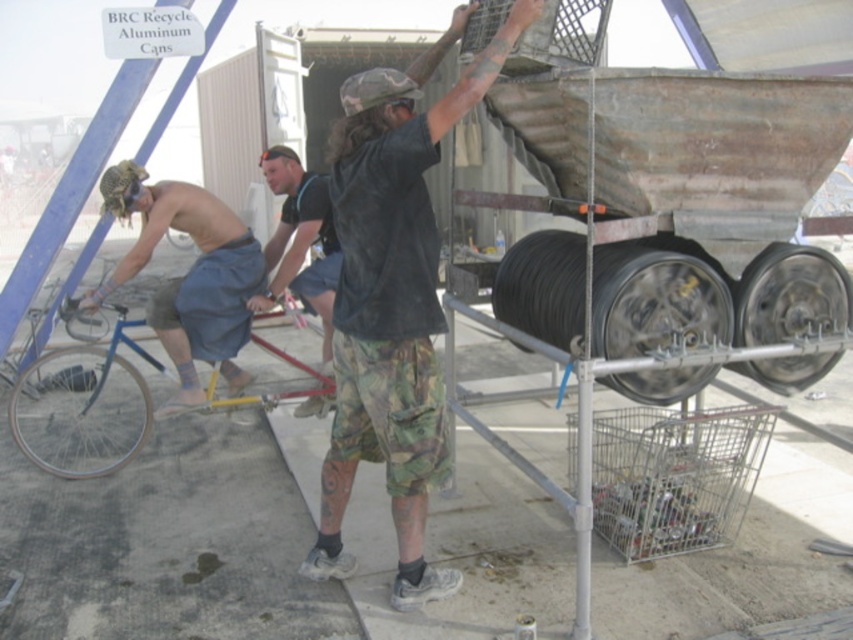
Question: Is blue matte bicycle at left below rubber tire at center?

Choices:
 (A) yes
 (B) no

Answer: (A)

Question: Does black rubber tire at right have a greater width compared to black cotton shirt at center?

Choices:
 (A) yes
 (B) no

Answer: (A)

Question: Is blue matte bicycle at left to the right of black rubber tire at center from the viewer's perspective?

Choices:
 (A) yes
 (B) no

Answer: (B)

Question: Which object is farther from the camera taking this photo?

Choices:
 (A) black rubber tire at right
 (B) metallic silver wheel at left

Answer: (B)

Question: Which point is farther to the camera?

Choices:
 (A) (570, 284)
 (B) (136, 454)
 (C) (123, 262)

Answer: (B)

Question: Which object is farther from the camera taking this photo?

Choices:
 (A) black rubber wheel at right
 (B) black rubber tire at right
 (C) blue matte bicycle at left
 (D) metallic silver wheel at left

Answer: (D)